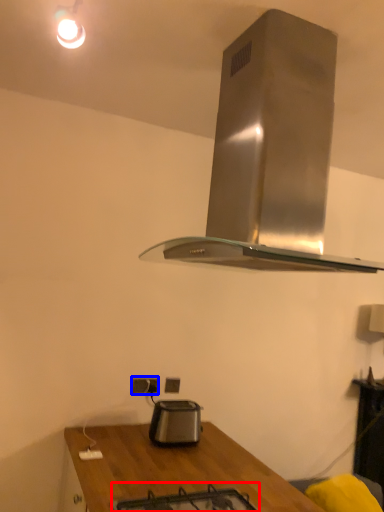
Question: Which object appears closest to the camera in this image, gas stove (highlighted by a red box) or electric outlet (highlighted by a blue box)?

Choices:
 (A) gas stove
 (B) electric outlet

Answer: (A)